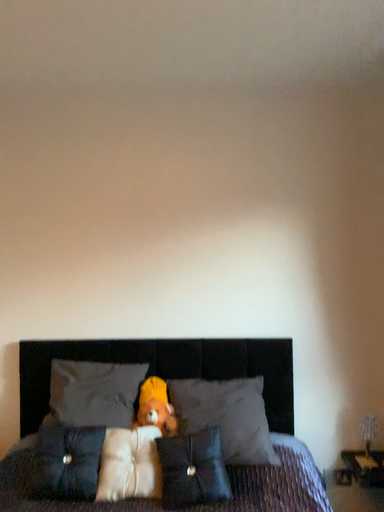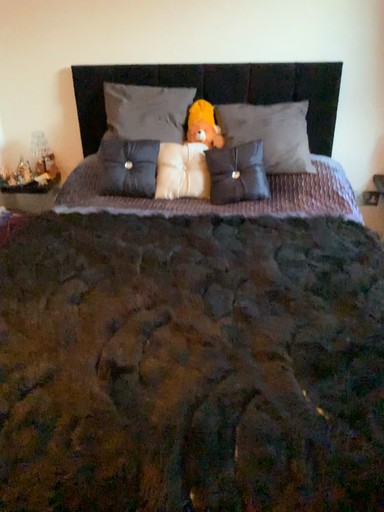
Question: How did the camera likely rotate when shooting the video?

Choices:
 (A) rotated upward
 (B) rotated downward

Answer: (B)